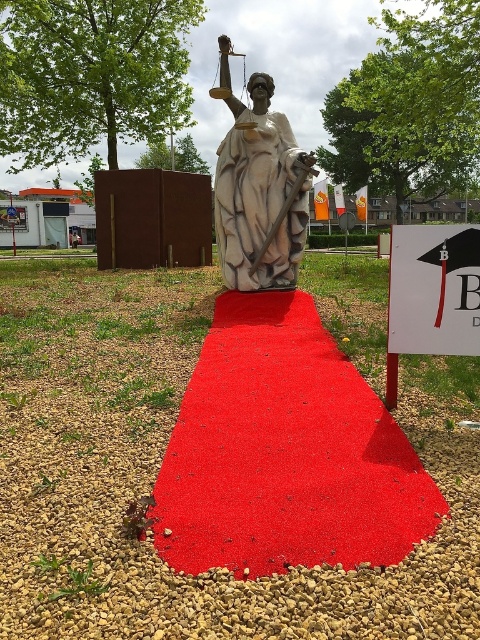
You are a visitor approaching the statue of Lady Justice on the red carpet at center. You notice a white paper sign at center nearby. Which object occupies more space in the scene?

The red carpet at center has a larger size compared to the white paper sign at center, so the red carpet at center occupies more space in the scene.

Consider the image. You are a photographer standing at the base of the red carpet leading to the statue. You want to take a picture of both the white marble statue at center and the white paper sign at center. Which object should you focus on first if you want to capture both in the same frame?

The white marble statue at center is located above the white paper sign at center, so you should focus on the white paper sign at center first to ensure both are in the frame.

You are standing at the bottom of the red carpet at center. Which direction should you walk to reach the statue of Lady Justice?

Since the red carpet at center leads up to the statue of Lady Justice, you should walk forward along the red carpet at center to reach the statue.